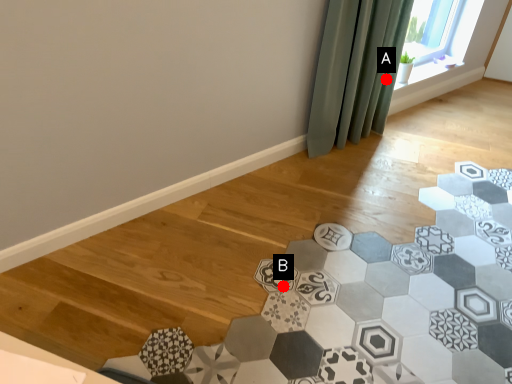
Question: Two points are circled on the image, labeled by A and B beside each circle. Among these points, which one is farthest from the camera?

Choices:
 (A) A is further
 (B) B is further

Answer: (A)